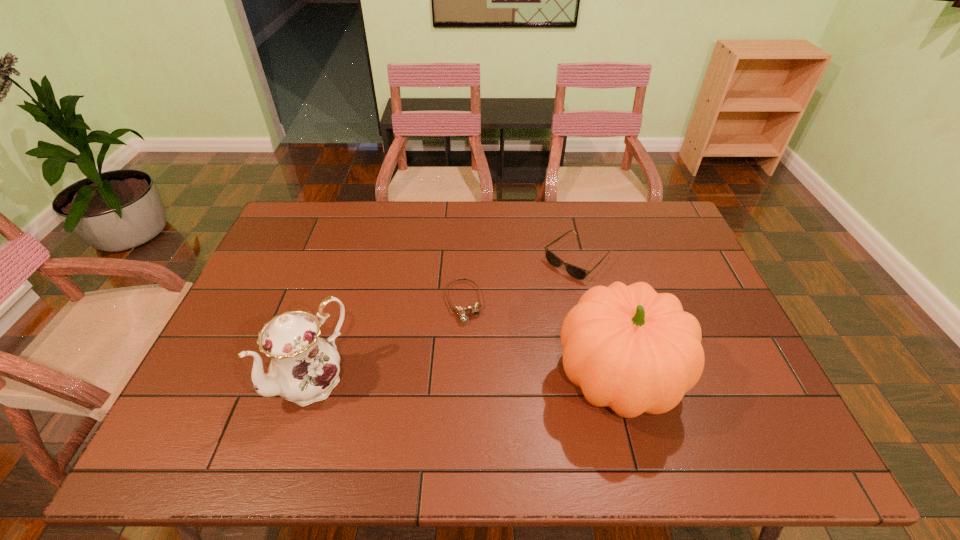
You are a GUI agent. You are given a task and a screenshot of the screen. Output one action in this format:
    pyautogui.click(x=<x>, y=<y>)
    Task: Click on the free space located 0.330m on the lenses of the second shortest object
    This screenshot has width=960, height=540.
    Given the screenshot: What is the action you would take?
    pyautogui.click(x=484, y=339)

Locate an element on the screen. The width and height of the screenshot is (960, 540). vacant space located on the lenses of the second shortest object is located at coordinates (547, 285).

Where is `vacant space located on the lenses of the second shortest object`? vacant space located on the lenses of the second shortest object is located at coordinates (476, 345).

What are the coordinates of `object that is at the far edge` in the screenshot? It's located at click(575, 272).

I want to click on chinaware present at the near edge, so click(x=304, y=368).

Where is `pumpkin positioned at the near edge`? The width and height of the screenshot is (960, 540). pumpkin positioned at the near edge is located at coordinates (632, 349).

In the image, there is a desktop. Where is `vacant area at the far edge`? vacant area at the far edge is located at coordinates [x=494, y=211].

In the image, there is a desktop. Where is `free region at the near edge`? The height and width of the screenshot is (540, 960). free region at the near edge is located at coordinates (386, 384).

The image size is (960, 540). In order to click on vacant space at the left edge in this screenshot , I will do `click(262, 302)`.

In the image, there is a desktop. Find the location of `vacant space at the right edge`. vacant space at the right edge is located at coordinates (690, 308).